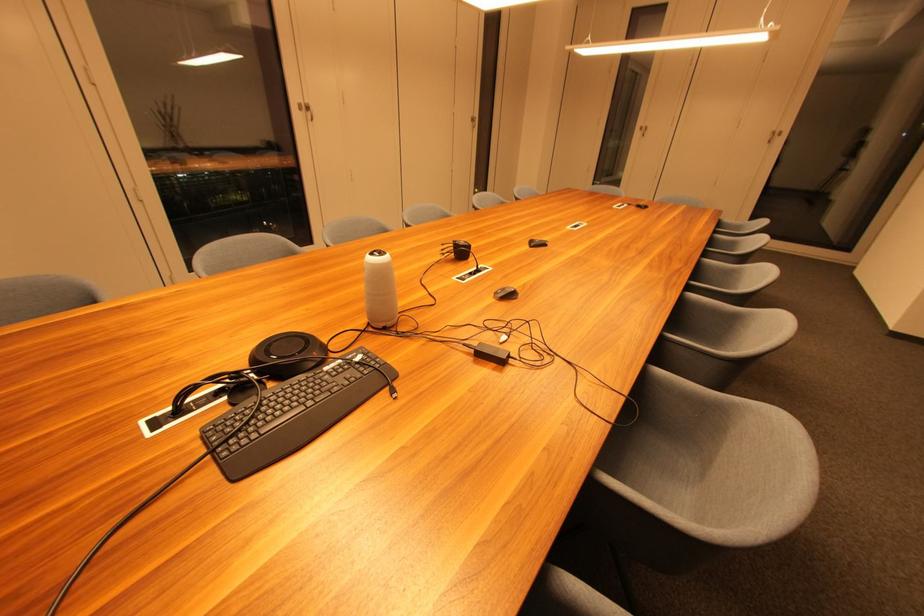
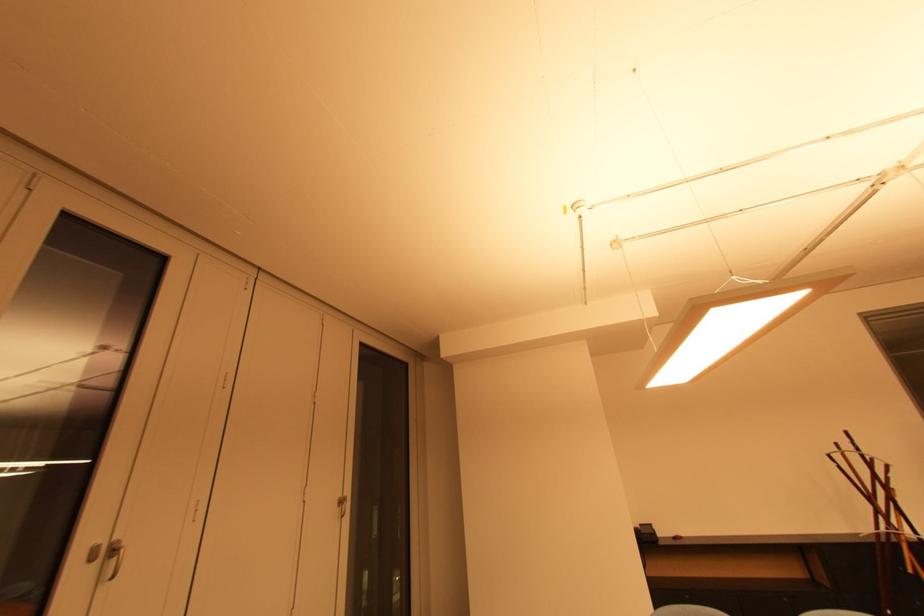
In the second image, find the point that corresponds to pixel 781 135 in the first image.

(346, 504)